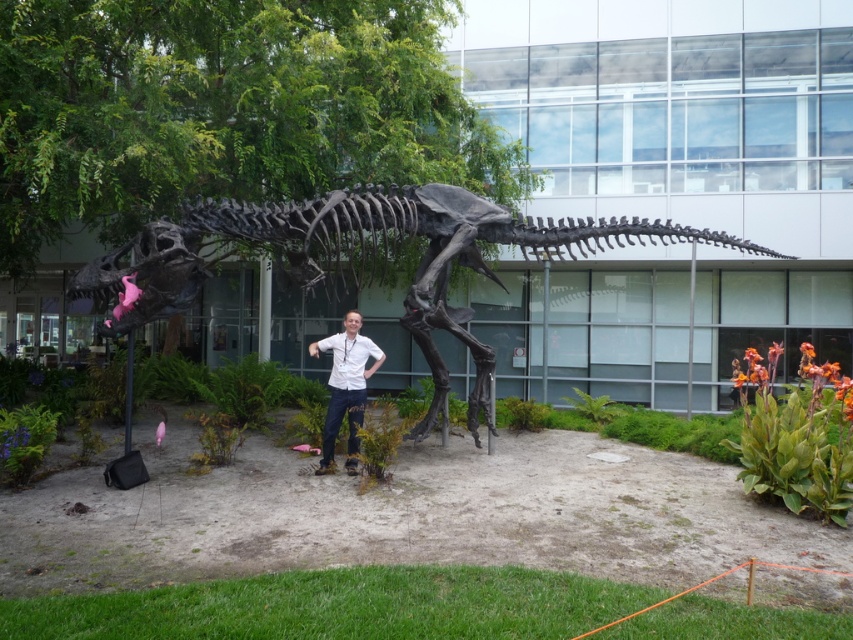
You are a photographer trying to capture the shiny metallic dinosaur skeleton at center and the white matte shirt at center in the same frame. Based on their heights, which object should you focus on first to ensure both are in the frame?

The shiny metallic dinosaur skeleton at center has a lesser height compared to the white matte shirt at center, so you should focus on the taller white matte shirt at center first to ensure both are in the frame.

You are a photographer trying to capture a clear shot of the shiny metallic dinosaur skeleton at center and the white matte shirt at center. Based on their positions, which object should you focus on first to ensure both are in frame?

You should focus on the shiny metallic dinosaur skeleton at center first because it is positioned to the right of the white matte shirt at center, so adjusting the frame to include both would require ensuring the skeleton is within the right side of the frame first.